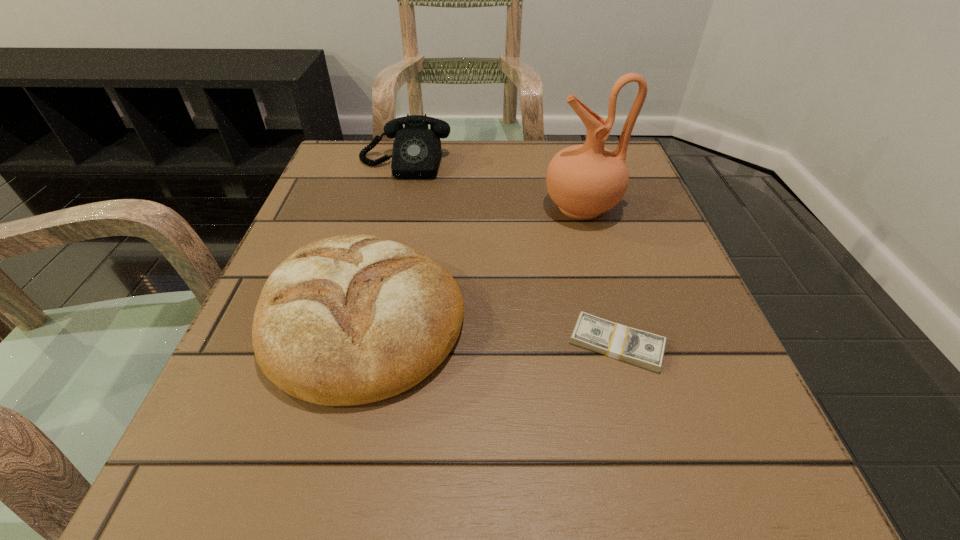
Where is `free region at the near edge`? free region at the near edge is located at coordinates (374, 461).

This screenshot has width=960, height=540. In the image, there is a desktop. Find the location of `free space at the left edge`. free space at the left edge is located at coordinates (332, 225).

Where is `free spot at the right edge of the desktop`? This screenshot has height=540, width=960. free spot at the right edge of the desktop is located at coordinates (615, 247).

Identify the location of vacant space at the far left corner of the desktop. This screenshot has width=960, height=540. (384, 156).

In order to click on empty space between the dollar and the bread in this screenshot , I will do `click(491, 331)`.

This screenshot has height=540, width=960. I want to click on free space between the telephone and the pottery, so click(x=492, y=186).

In order to click on empty location between the farthest object and the shortest object in this screenshot , I will do `click(511, 254)`.

At what (x,y) coordinates should I click in order to perform the action: click on free space that is in between the dollar and the bread. Please return your answer as a coordinate pair (x, y). Looking at the image, I should click on (491, 331).

Locate an element on the screen. This screenshot has width=960, height=540. free spot between the farthest object and the pottery is located at coordinates (492, 186).

The height and width of the screenshot is (540, 960). Identify the location of free spot between the second farthest object and the bread. (472, 263).